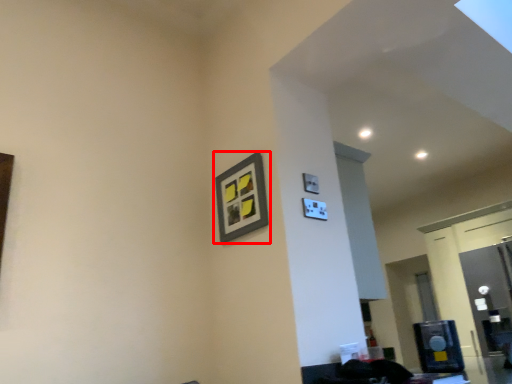
Question: Where is picture frame (annotated by the red box) located in relation to glass door in the image?

Choices:
 (A) right
 (B) left

Answer: (B)